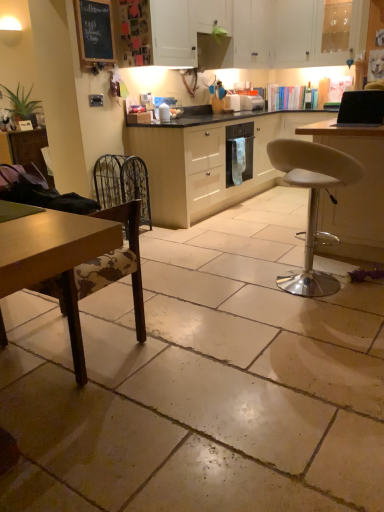
Where is `free space underneath white leather stool at center-right, which is the first chair from right to left (from a real-world perspective)`? The height and width of the screenshot is (512, 384). free space underneath white leather stool at center-right, which is the first chair from right to left (from a real-world perspective) is located at coordinates (303, 292).